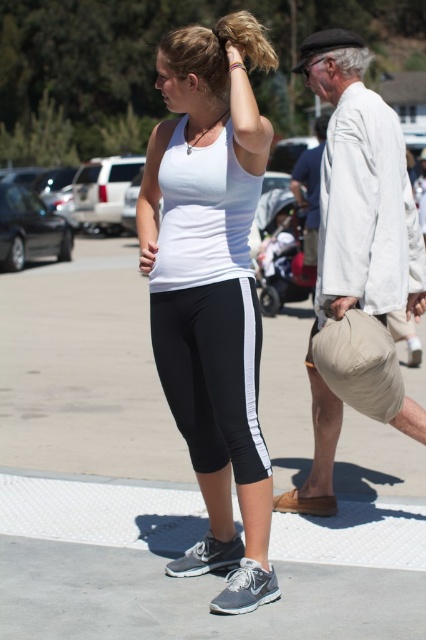
Can you confirm if khaki cotton shorts at right is positioned to the left of blonde hair at upper center?

In fact, khaki cotton shorts at right is to the right of blonde hair at upper center.

Between point (325, 412) and point (252, 58), which one is positioned behind?

Positioned behind is point (325, 412).

Locate an element on the screen. The height and width of the screenshot is (640, 426). khaki cotton shorts at right is located at coordinates (357, 262).

Does white matte tank top at center have a lesser width compared to black matte leggings at center?

Incorrect, white matte tank top at center's width is not less than black matte leggings at center's.

Who is positioned more to the right, white matte tank top at center or black matte leggings at center?

black matte leggings at center

What do you see at coordinates (210, 300) in the screenshot? The height and width of the screenshot is (640, 426). I see `white matte tank top at center` at bounding box center [210, 300].

Locate an element on the screen. This screenshot has width=426, height=640. white matte tank top at center is located at coordinates (210, 300).

In the scene shown: Can you confirm if black matte leggings at center is wider than blonde hair at upper center?

Indeed, black matte leggings at center has a greater width compared to blonde hair at upper center.

The width and height of the screenshot is (426, 640). What are the coordinates of `black matte leggings at center` in the screenshot? It's located at (213, 372).

The image size is (426, 640). Identify the location of black matte leggings at center. click(x=213, y=372).